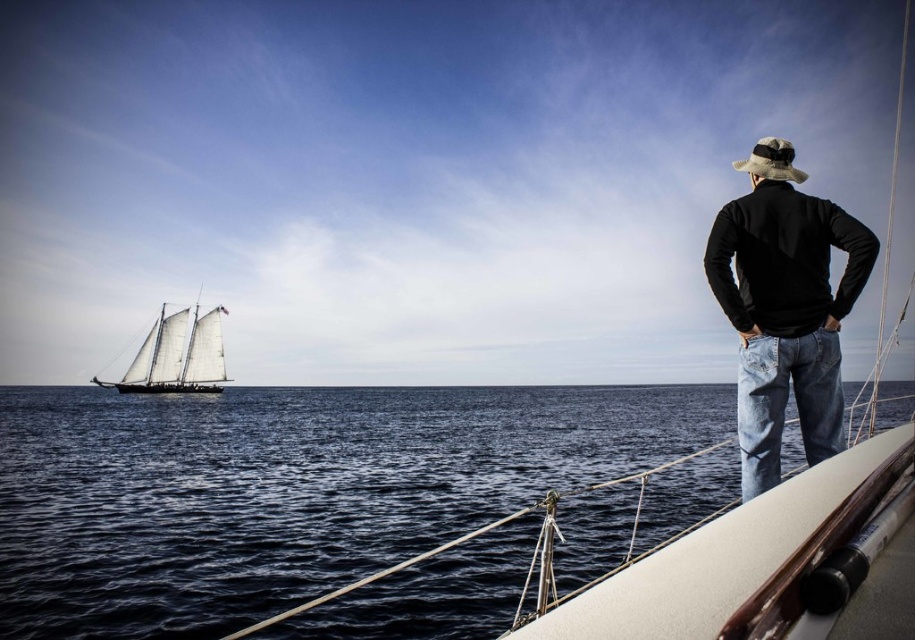
Is black matte jacket at upper right shorter than white canvas sailboat at left?

Indeed, black matte jacket at upper right has a lesser height compared to white canvas sailboat at left.

Where is `black matte jacket at upper right`? Image resolution: width=915 pixels, height=640 pixels. black matte jacket at upper right is located at coordinates (784, 307).

Where is `black matte jacket at upper right`? This screenshot has width=915, height=640. black matte jacket at upper right is located at coordinates (784, 307).

Between dark blue water at center and white canvas sailboat at left, which one appears on the left side from the viewer's perspective?

Positioned to the left is white canvas sailboat at left.

Between dark blue water at center and white canvas sailboat at left, which one is positioned lower?

dark blue water at center is lower down.

Between point (460, 392) and point (143, 381), which one is positioned behind?

The point (460, 392) is more distant.

Image resolution: width=915 pixels, height=640 pixels. In order to click on dark blue water at center in this screenshot , I will do `click(300, 492)`.

Which is in front, point (401, 522) or point (743, 474)?

Point (743, 474) is in front.

Who is shorter, dark blue water at center or black matte jacket at upper right?

black matte jacket at upper right is shorter.

The height and width of the screenshot is (640, 915). What do you see at coordinates (300, 492) in the screenshot? I see `dark blue water at center` at bounding box center [300, 492].

Where is `dark blue water at center`? dark blue water at center is located at coordinates (300, 492).